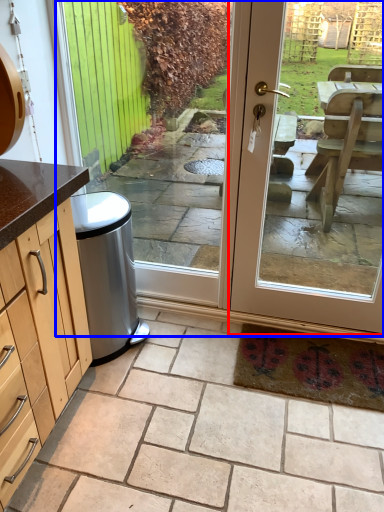
Question: Which of the following is the closest to the observer, door (highlighted by a red box) or screen door (highlighted by a blue box)?

Choices:
 (A) door
 (B) screen door

Answer: (A)